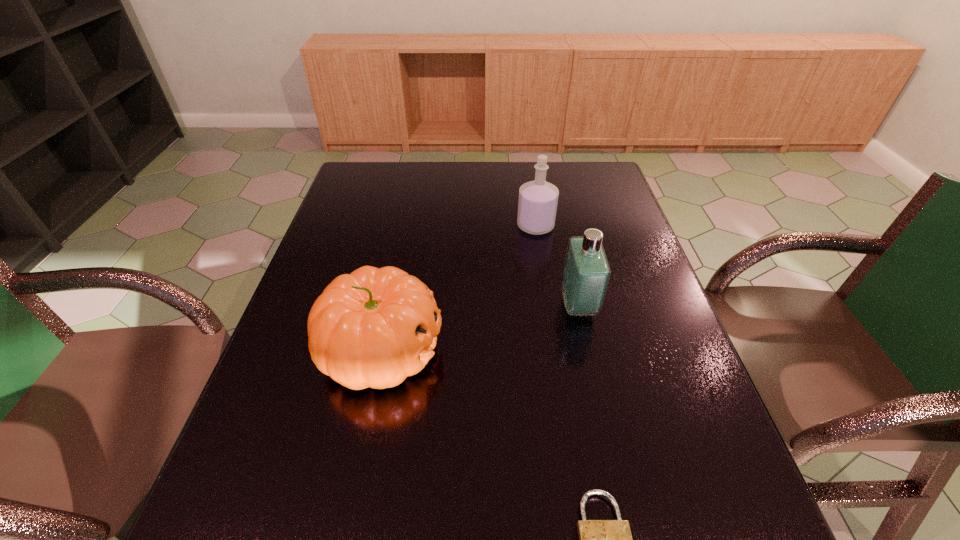
You are a GUI agent. You are given a task and a screenshot of the screen. Output one action in this format:
    pyautogui.click(x=<x>, y=<y>)
    Task: Click on the free space between the nearer perfume and the leftmost object
    
    Given the screenshot: What is the action you would take?
    pyautogui.click(x=480, y=327)

Find the location of `free space between the leftmost object and the farther perfume`. free space between the leftmost object and the farther perfume is located at coordinates [x=458, y=287].

Choose which object is the nearest neighbor to the farthest object. Please provide its 2D coordinates. Your answer should be formatted as a tuple, i.e. [(x, y)], where the tuple contains the x and y coordinates of a point satisfying the conditions above.

[(586, 275)]

Choose which object is the third nearest neighbor to the farthest object. Please provide its 2D coordinates. Your answer should be formatted as a tuple, i.e. [(x, y)], where the tuple contains the x and y coordinates of a point satisfying the conditions above.

[(598, 539)]

Locate an element on the screen. free space that satisfies the following two spatial constraints: 1. on the front side of the farthest object; 2. on the carved face of the pumpkin is located at coordinates (554, 349).